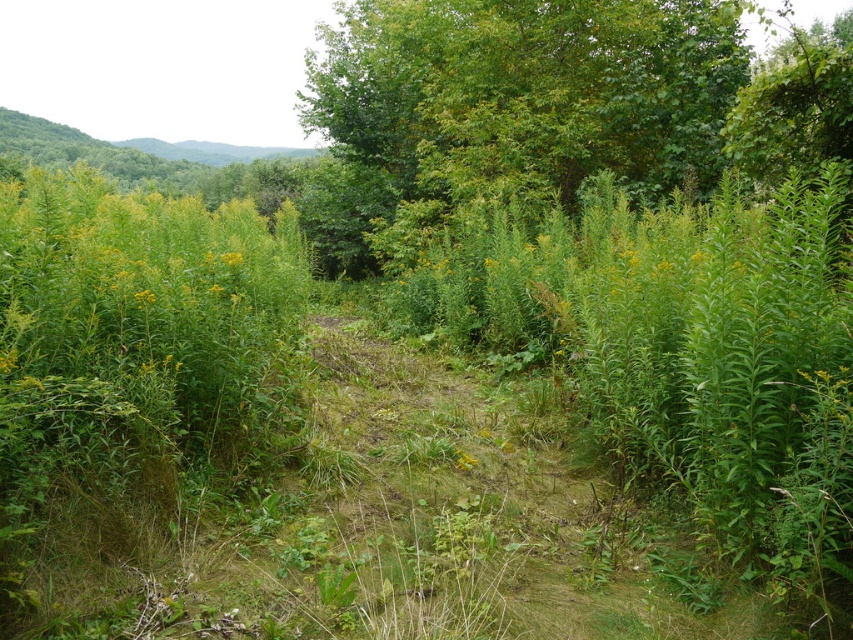
From the picture: You are a hiker trying to navigate through the overgrown area. You see the green leafy tree at upper center and the yellow matte flower at center. Which object is bigger in size?

The green leafy tree at upper center is larger in size than the yellow matte flower at center.